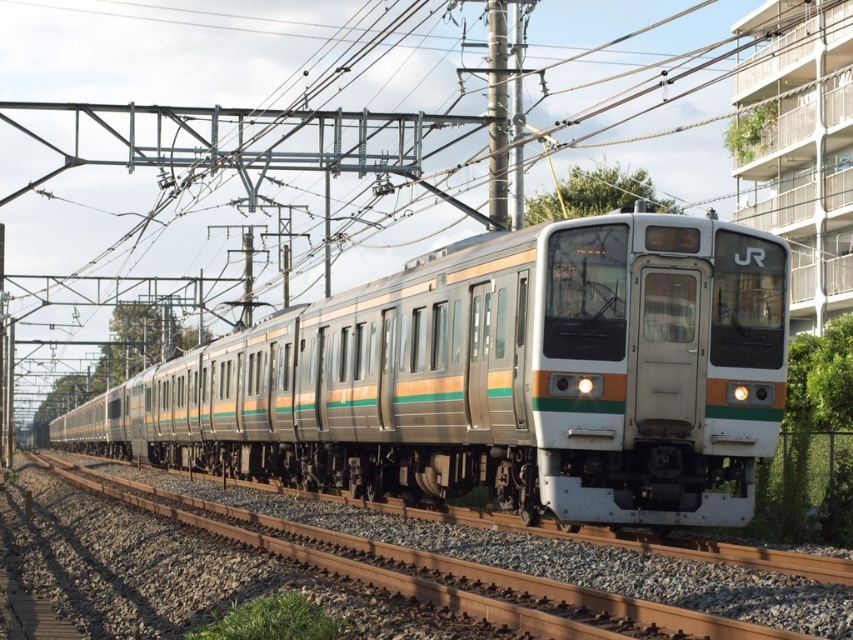
You are a maintenance worker needing to access the brown gravel at lower left while the silver metallic train at center is present. Is there enough space between them for you to safely walk through?

The distance between the silver metallic train at center and the brown gravel at lower left is 2.97 meters, which is sufficient for a maintenance worker to safely walk through.

You are a maintenance worker checking the clearance of the railway tracks. The brown gravel at lower left is at ground level. Can the silver metallic train at center pass through this section without any issues?

The silver metallic train at center is much taller than the brown gravel at lower left, so it can pass through without any issues as there is sufficient vertical clearance.